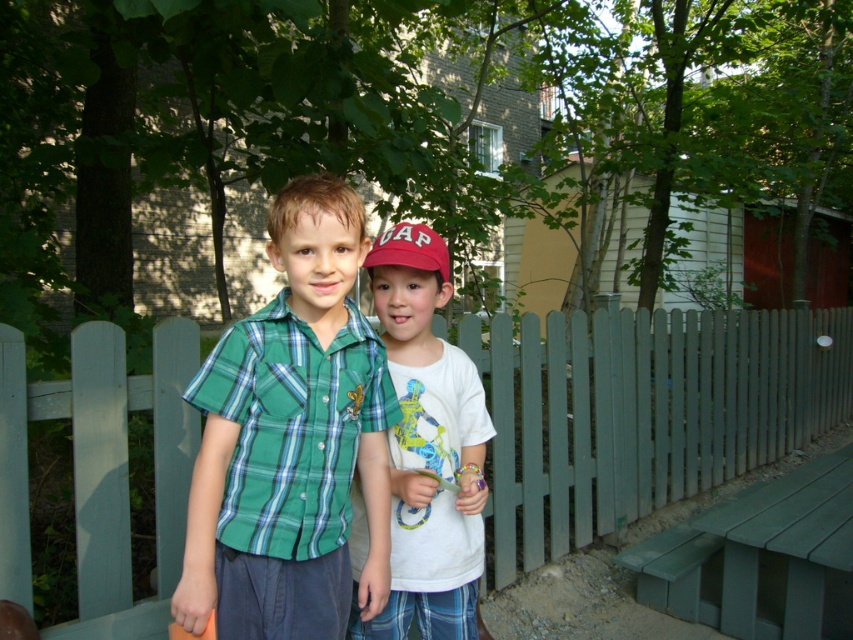
You are a photographer setting up for a family portrait. You want to position the two boys so that they are both visible in the frame without any obstruction from the green wooden fence at center or the green painted wood park bench at lower right. Based on their current positions, which boy should you move to ensure they are both fully visible?

The photographer should move the boy on the right, as the green wooden fence at center is to the left of the green painted wood park bench at lower right. Since the boy on the right is near the bench, moving him away from the bench and fence would ensure both boys are visible without obstruction.